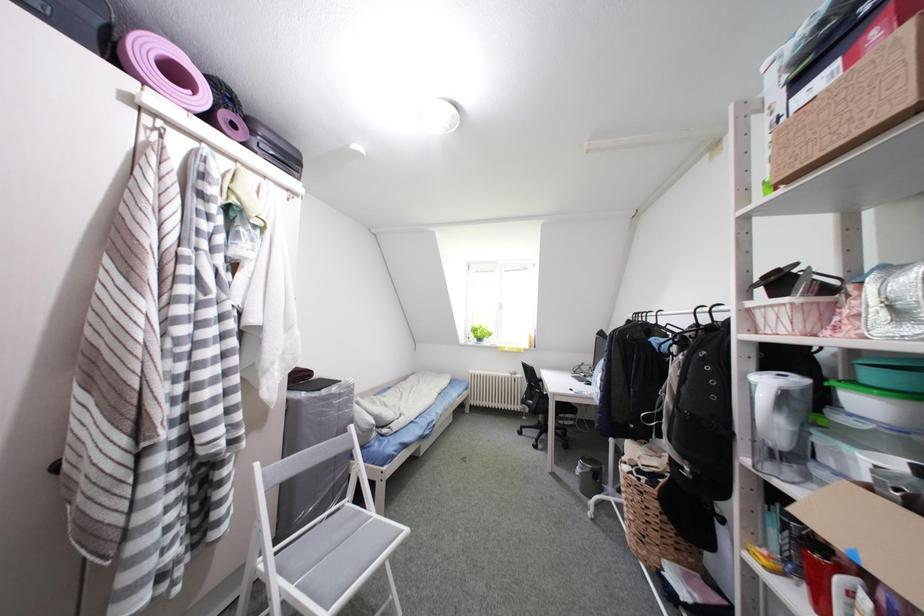
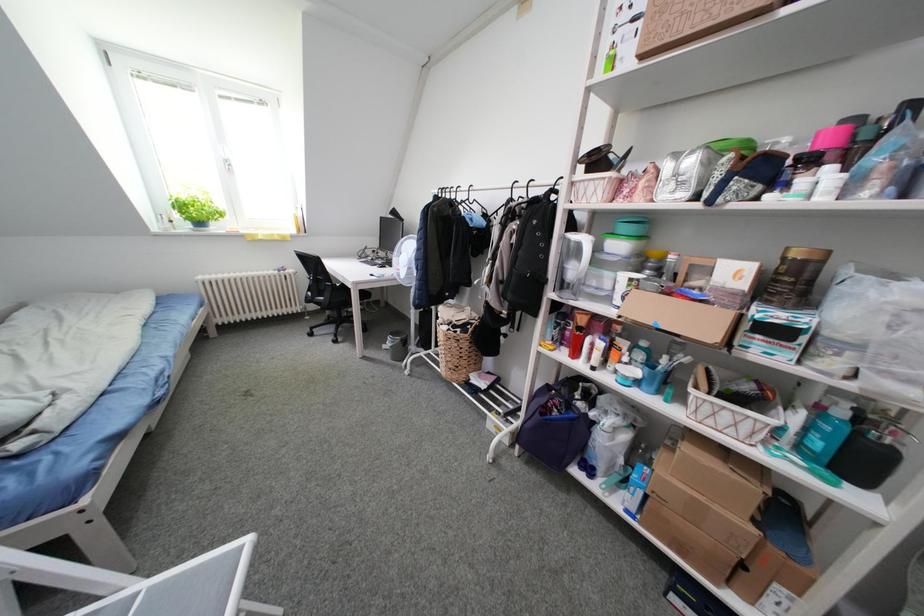
Based on the continuous images, in which direction is the camera rotating?

The camera's rotation is toward right-down.